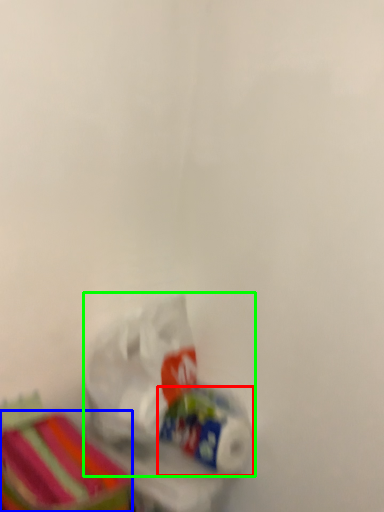
Question: Estimate the real-world distances between objects in this image. Which object is closer to toilet paper (highlighted by a red box), storage box (highlighted by a blue box) or plastic bag (highlighted by a green box)?

Choices:
 (A) storage box
 (B) plastic bag

Answer: (B)